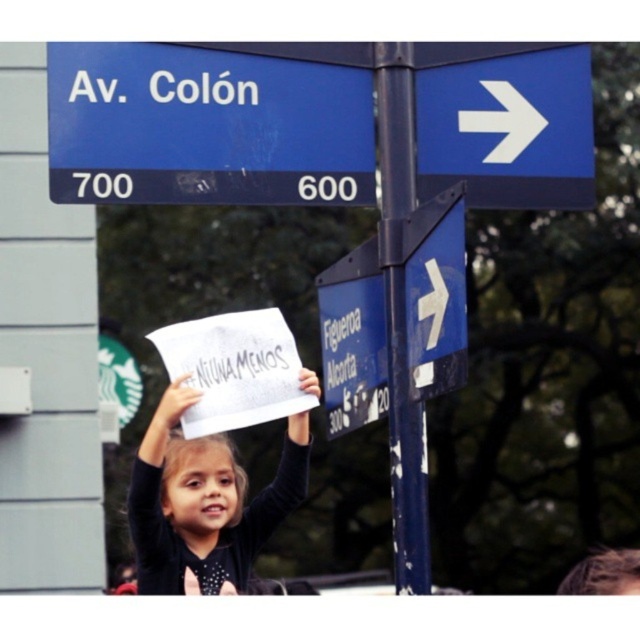
Question: Which object appears closest to the camera in this image?

Choices:
 (A) dark blue shirt at center
 (B) blue painted metal pole at right

Answer: (B)

Question: Which point is farther to the camera?

Choices:
 (A) blue plastic arrow at upper right
 (B) dark blue shirt at center

Answer: (B)

Question: Does dark blue shirt at center have a larger size compared to blue painted metal pole at right?

Choices:
 (A) yes
 (B) no

Answer: (A)

Question: Is blue plastic street sign at upper left bigger than dark blue shirt at center?

Choices:
 (A) yes
 (B) no

Answer: (B)

Question: Does blue plastic street sign at upper left appear on the left side of blue plastic sign at center right?

Choices:
 (A) no
 (B) yes

Answer: (B)

Question: Which point appears farthest from the camera in this image?

Choices:
 (A) pyautogui.click(x=349, y=426)
 (B) pyautogui.click(x=140, y=577)

Answer: (B)